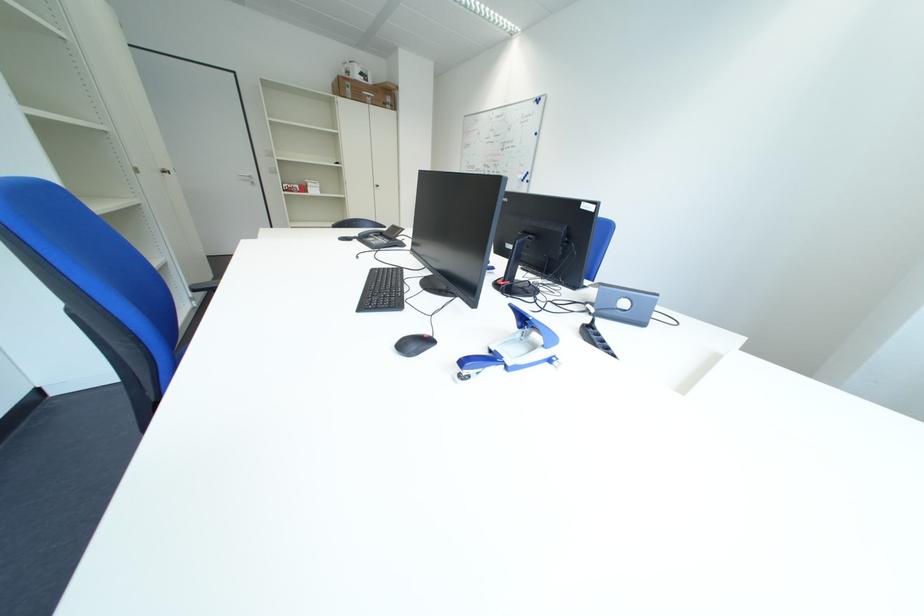
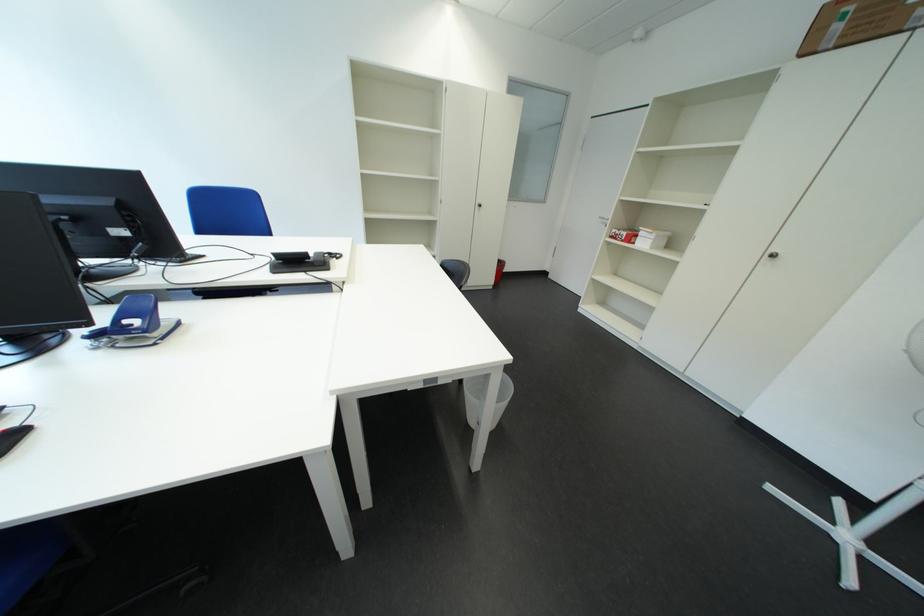
The point at (360, 92) is marked in the first image. Where is the corresponding point in the second image?

(849, 30)